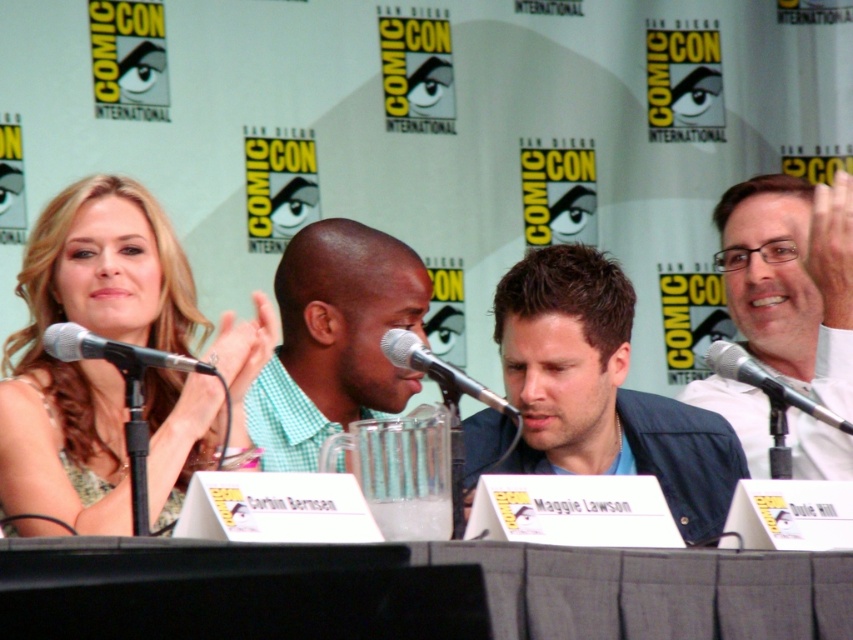
You are attending Comic Con and want to take a photo of the dark blue jacket at center and the metallic silver microphone at center. Which object will appear larger in your photo?

The dark blue jacket at center will appear larger in your photo because it is closer to you than the metallic silver microphone at center.

You are a photographer at the event and need to position a camera to capture both the metallic silver microphone at center and the silver metallic microphone at center clearly. Since the two microphones are different in height, which one should you focus on to ensure the taller one is in frame?

The silver metallic microphone at center is taller than the metallic silver microphone at center, so you should focus on the silver metallic microphone at center to ensure the taller one is in frame.

You are a photographer at the event and want to place a camera at point 0.550 on the x axis. Will the black metallic microphone at left block the camera from capturing the entire panelist seated to the right of it?

The black metallic microphone at left is positioned at point 0.550 on the x axis and 0.135 on the y axis. Since the camera is placed at the same x coordinate, it may block the view of the panelist to the right depending on the camera angle and the microphone height, but based on the provided coordinates alone, the microphone is directly in line on the x axis and could obstruct the shot.